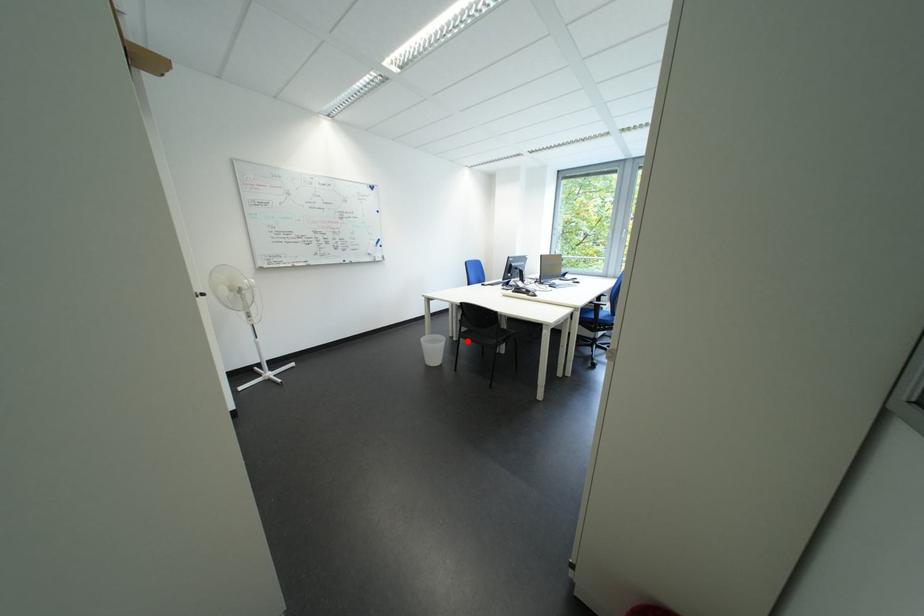
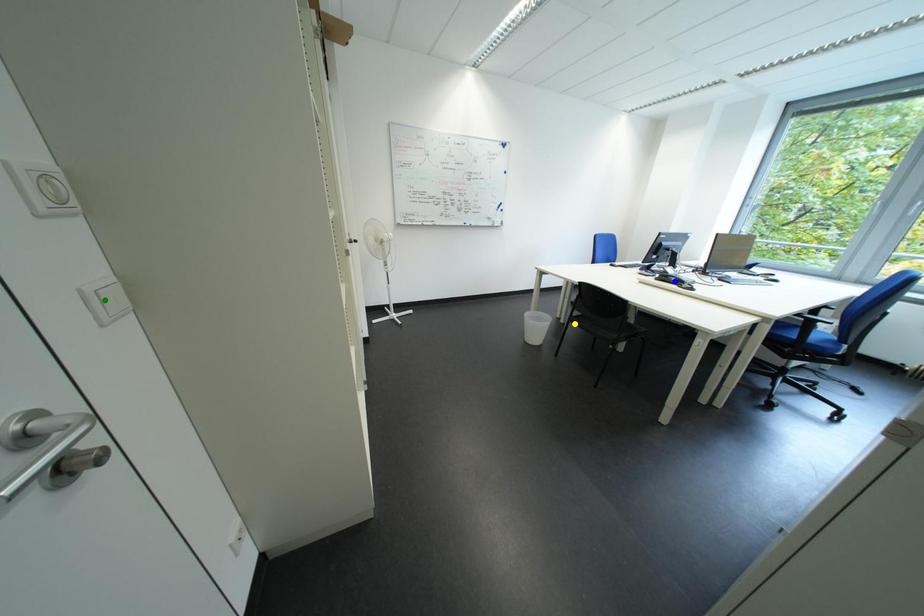
Question: I am providing you with two images of the same scene from different viewpoints. A red point is marked on the first image. You are given multiple points on the second image. Which spot in image 2 lines up with the point in image 1?

Choices:
 (A) green point
 (B) yellow point
 (C) blue point

Answer: (B)